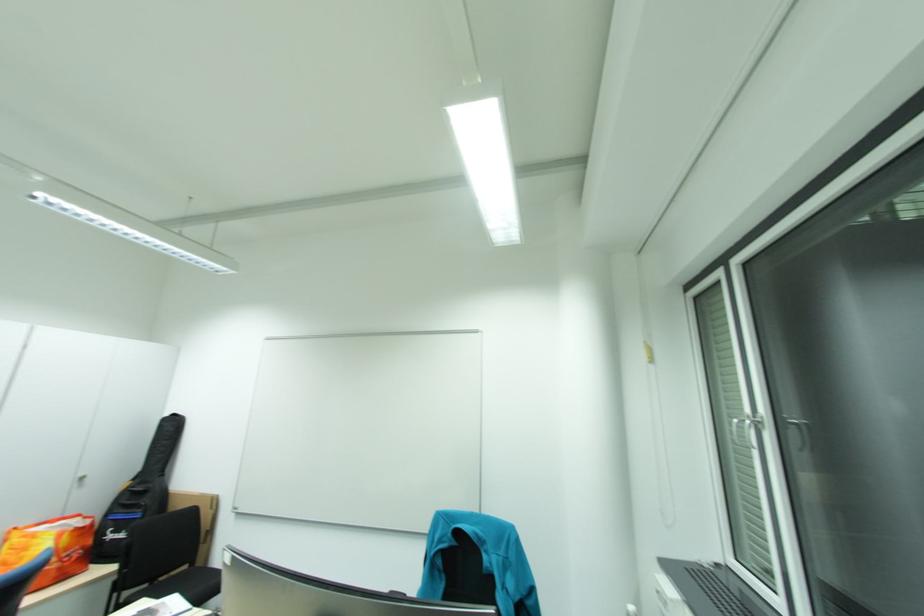
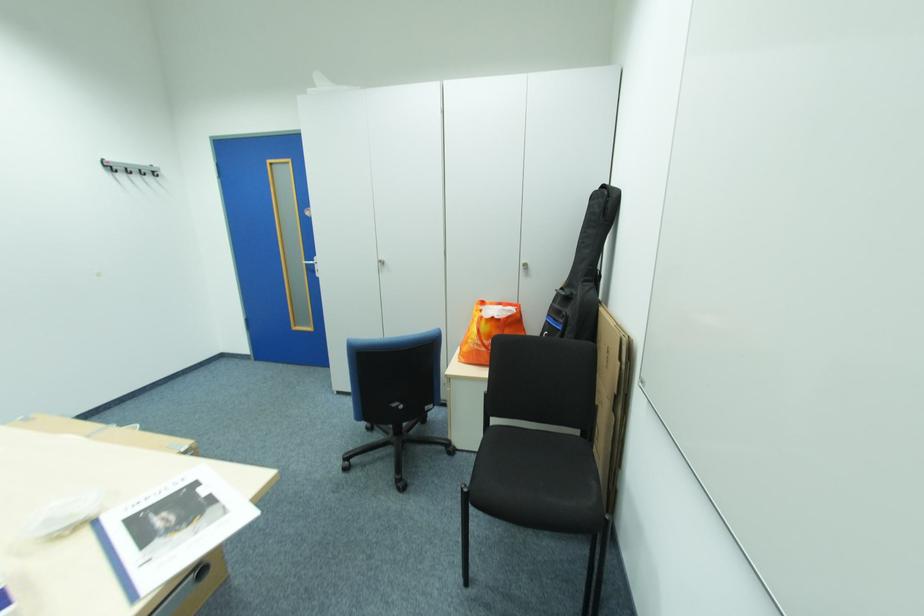
In the second image, find the point that corresponds to pixel 149 508 in the first image.

(572, 318)